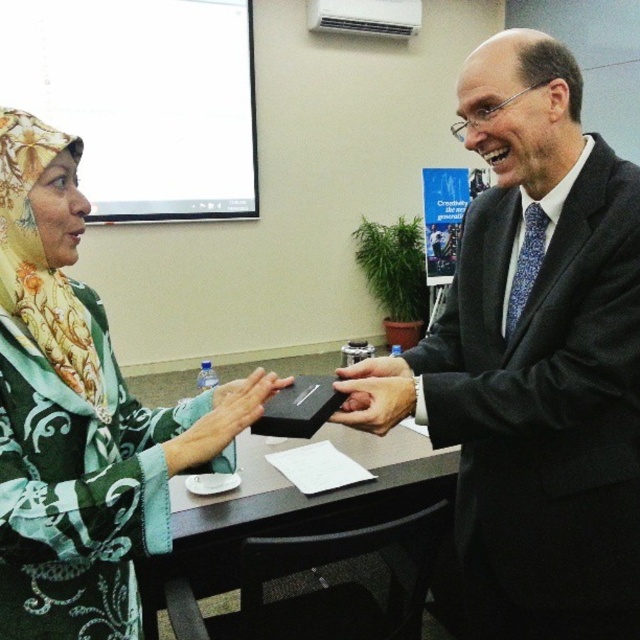
You are an assistant who needs to determine the spatial relationship between the two black items in the scene. Which object, the matte black suit at center or the matte black phone at center, is positioned higher in the image?

The matte black suit at center is above the matte black phone at center, so the matte black suit at center is positioned higher in the image.

You are a photographer taking a portrait of the two people in the scene. You want to ensure that both the matte black suit at center and the green floral scarf at left are clearly visible in the photo. Given their height difference, which object should you focus on to capture both effectively?

The matte black suit at center is much taller than the green floral scarf at left. To capture both effectively, focus on the matte black suit at center as the primary subject, ensuring the camera angle accommodates its height while still framing the green floral scarf at left within the shot.